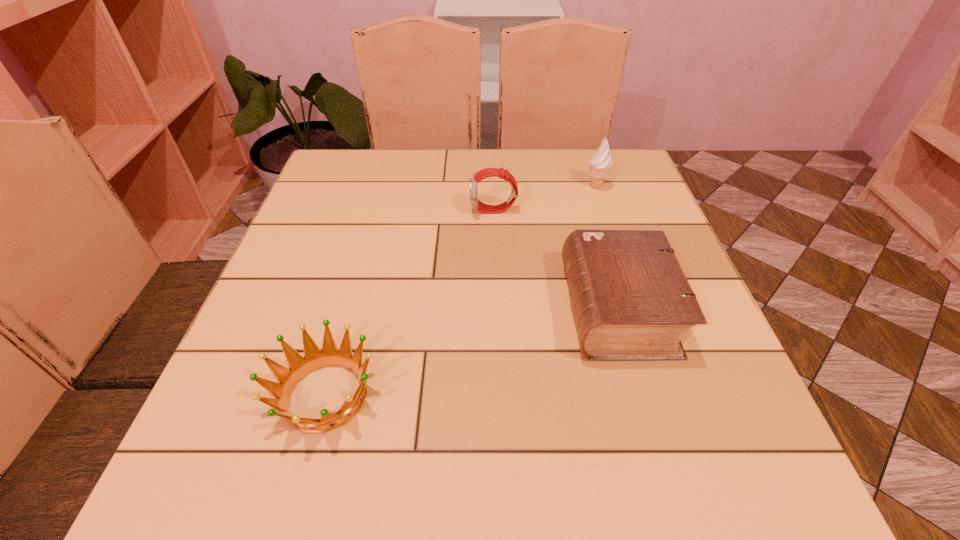
At what (x,y) coordinates should I click in order to perform the action: click on the farthest object. Please return your answer as a coordinate pair (x, y). The image size is (960, 540). Looking at the image, I should click on (600, 163).

At what (x,y) coordinates should I click in order to perform the action: click on icecream. Please return your answer as a coordinate pair (x, y). This screenshot has width=960, height=540. Looking at the image, I should click on coord(600,163).

Find the location of a particular element. This screenshot has height=540, width=960. the third nearest object is located at coordinates (487, 172).

At what (x,y) coordinates should I click in order to perform the action: click on the second object from left to right. Please return your answer as a coordinate pair (x, y). The height and width of the screenshot is (540, 960). Looking at the image, I should click on (487, 172).

At what (x,y) coordinates should I click in order to perform the action: click on Bible. Please return your answer as a coordinate pair (x, y). Image resolution: width=960 pixels, height=540 pixels. Looking at the image, I should click on (631, 300).

Locate an element on the screen. the shortest object is located at coordinates (299, 367).

The image size is (960, 540). Find the location of `the leftmost object`. the leftmost object is located at coordinates 299,367.

Image resolution: width=960 pixels, height=540 pixels. What are the coordinates of `free location located on the front-facing side of the farthest object` in the screenshot? It's located at (505, 186).

Find the location of a particular element. Image resolution: width=960 pixels, height=540 pixels. free space located 0.170m on the front-facing side of the farthest object is located at coordinates (520, 186).

Locate an element on the screen. The height and width of the screenshot is (540, 960). vacant space located on the front-facing side of the farthest object is located at coordinates (497, 186).